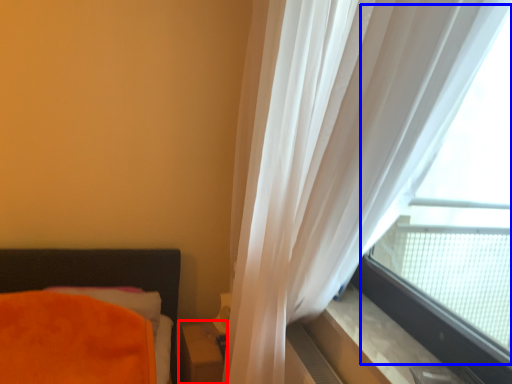
Question: Which of the following is the closest to the observer, table (highlighted by a red box) or bay window (highlighted by a blue box)?

Choices:
 (A) table
 (B) bay window

Answer: (B)